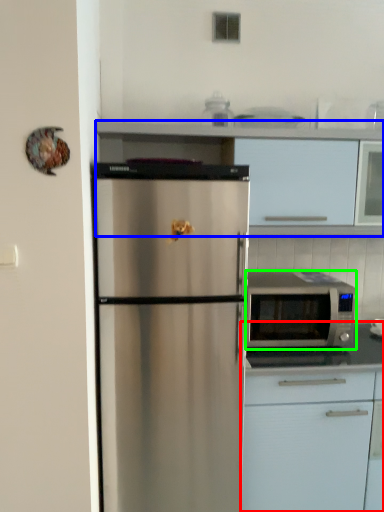
Question: Which object is the farthest from cabinetry (highlighted by a red box)? Choose among these: cabinetry (highlighted by a blue box) or microwave oven (highlighted by a green box).

Choices:
 (A) cabinetry
 (B) microwave oven

Answer: (A)